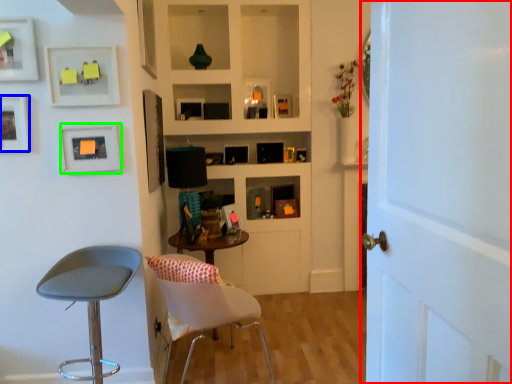
Question: Considering the real-world distances, which object is farthest from door (highlighted by a red box)? picture frame (highlighted by a blue box) or picture frame (highlighted by a green box)?

Choices:
 (A) picture frame
 (B) picture frame

Answer: (A)